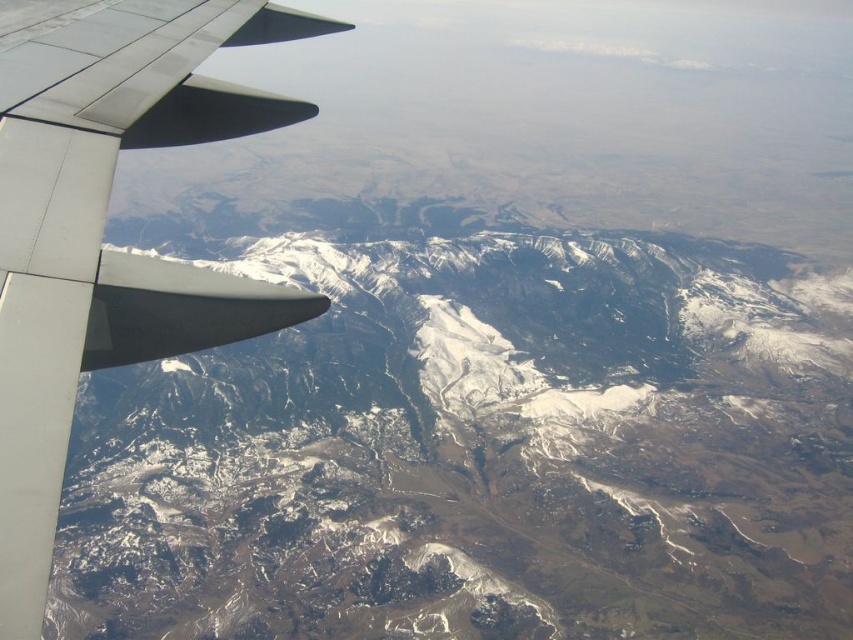
Question: Which object appears closest to the camera in this image?

Choices:
 (A) metallic gray wing at left
 (B) snowy rocky mountain range at upper left

Answer: (A)

Question: Which point is farther to the camera?

Choices:
 (A) (125, 65)
 (B) (486, 268)

Answer: (B)

Question: Observing the image, what is the correct spatial positioning of snowy rocky mountain range at upper left in reference to metallic gray wing at left?

Choices:
 (A) left
 (B) right

Answer: (B)

Question: Does snowy rocky mountain range at upper left have a lesser width compared to metallic gray wing at left?

Choices:
 (A) no
 (B) yes

Answer: (A)

Question: Does snowy rocky mountain range at upper left appear under metallic gray wing at left?

Choices:
 (A) no
 (B) yes

Answer: (B)